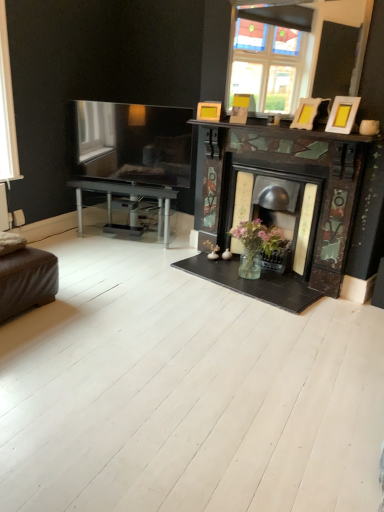
Question: Is wooden photo frame at upper right, positioned as the 2th picture frame in back-to-front order, not within matte yellow picture frame at upper right, acting as the 3th picture frame starting from the front?

Choices:
 (A) no
 (B) yes

Answer: (B)

Question: Would you say matte yellow picture frame at upper right, marked as the 1th picture frame in a left-to-right arrangement, is part of wooden photo frame at upper right, the 2th picture frame in the front-to-back sequence,'s contents?

Choices:
 (A) yes
 (B) no

Answer: (B)

Question: Is wooden photo frame at upper right, positioned as the 2th picture frame in back-to-front order, with matte yellow picture frame at upper right, marked as the 1th picture frame in a left-to-right arrangement?

Choices:
 (A) yes
 (B) no

Answer: (B)

Question: Does wooden photo frame at upper right, which is the 2th picture frame from left to right, have a larger size compared to matte yellow picture frame at upper right, which is the 3th picture frame in right-to-left order?

Choices:
 (A) no
 (B) yes

Answer: (B)

Question: From the image's perspective, is wooden photo frame at upper right, positioned as the 2th picture frame in back-to-front order, under matte yellow picture frame at upper right, which is the 3th picture frame in right-to-left order?

Choices:
 (A) yes
 (B) no

Answer: (A)

Question: Is wooden photo frame at upper right, positioned as the 2th picture frame in right-to-left order, positioned with its back to matte yellow picture frame at upper right, which is the 3th picture frame in right-to-left order?

Choices:
 (A) no
 (B) yes

Answer: (A)

Question: Does matte gold picture frame at upper right, which appears as the third picture frame when viewed from the left, contain wooden photo frame at upper right, which is the 2th picture frame from left to right?

Choices:
 (A) yes
 (B) no

Answer: (B)

Question: Is the depth of matte gold picture frame at upper right, which appears as the third picture frame when viewed from the left, greater than that of wooden photo frame at upper right, positioned as the 2th picture frame in back-to-front order?

Choices:
 (A) no
 (B) yes

Answer: (A)

Question: Can you confirm if matte gold picture frame at upper right, which is counted as the third picture frame, starting from the back, is shorter than wooden photo frame at upper right, positioned as the 2th picture frame in back-to-front order?

Choices:
 (A) no
 (B) yes

Answer: (A)

Question: From the image's perspective, is matte gold picture frame at upper right, which is counted as the third picture frame, starting from the back, located beneath wooden photo frame at upper right, which is the 2th picture frame from left to right?

Choices:
 (A) no
 (B) yes

Answer: (B)

Question: Is matte gold picture frame at upper right, which appears as the third picture frame when viewed from the left, closer to camera compared to wooden photo frame at upper right, positioned as the 2th picture frame in back-to-front order?

Choices:
 (A) no
 (B) yes

Answer: (B)

Question: From the image's perspective, is matte gold picture frame at upper right, which is the 1th picture frame in front-to-back order, above wooden photo frame at upper right, the 2th picture frame in the front-to-back sequence?

Choices:
 (A) yes
 (B) no

Answer: (B)

Question: Considering the relative positions of matte yellow picture frame at upper right, positioned as the first picture frame in back-to-front order, and wooden photo frame at upper right, the 2th picture frame in the front-to-back sequence, in the image provided, is matte yellow picture frame at upper right, positioned as the first picture frame in back-to-front order, to the left of wooden photo frame at upper right, the 2th picture frame in the front-to-back sequence, from the viewer's perspective?

Choices:
 (A) no
 (B) yes

Answer: (B)